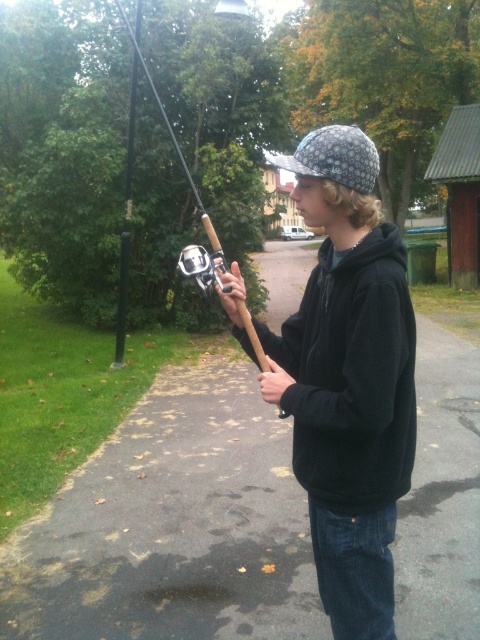
Question: Does matte black hoodie at center appear over black fleece sweatshirt at center?

Choices:
 (A) no
 (B) yes

Answer: (A)

Question: Which point is farther to the camera?

Choices:
 (A) matte black hoodie at center
 (B) black fleece sweatshirt at center
 (C) wooden fishing pole at center

Answer: (C)

Question: Which object is closer to the camera taking this photo?

Choices:
 (A) wooden fishing pole at center
 (B) wet asphalt path at center
 (C) black fleece sweatshirt at center

Answer: (C)

Question: Does wet asphalt path at center come in front of black fleece sweatshirt at center?

Choices:
 (A) no
 (B) yes

Answer: (A)

Question: Where is wet asphalt path at center located in relation to matte black hoodie at center in the image?

Choices:
 (A) left
 (B) right

Answer: (A)

Question: Which object is the farthest from the matte black hoodie at center?

Choices:
 (A) wet asphalt path at center
 (B) wooden fishing pole at center

Answer: (B)